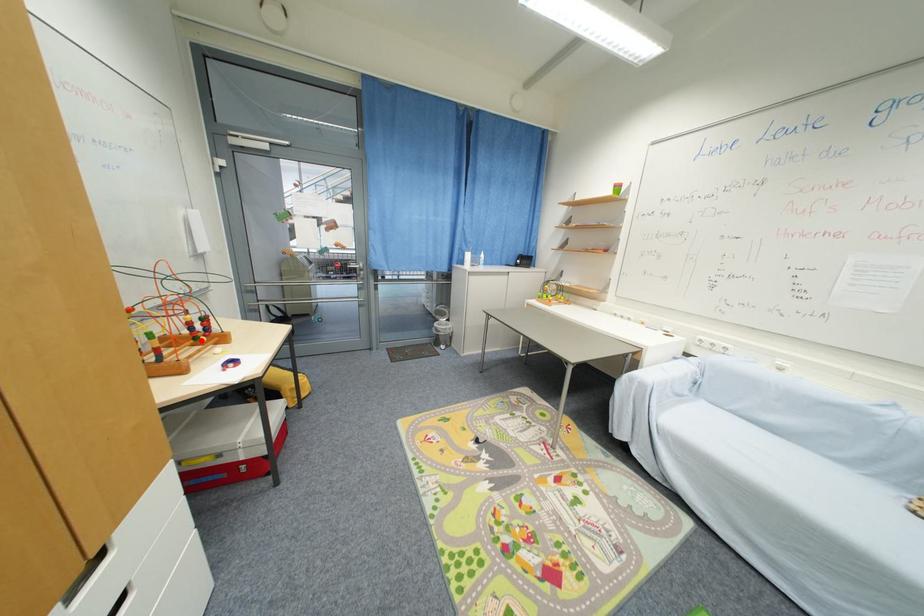
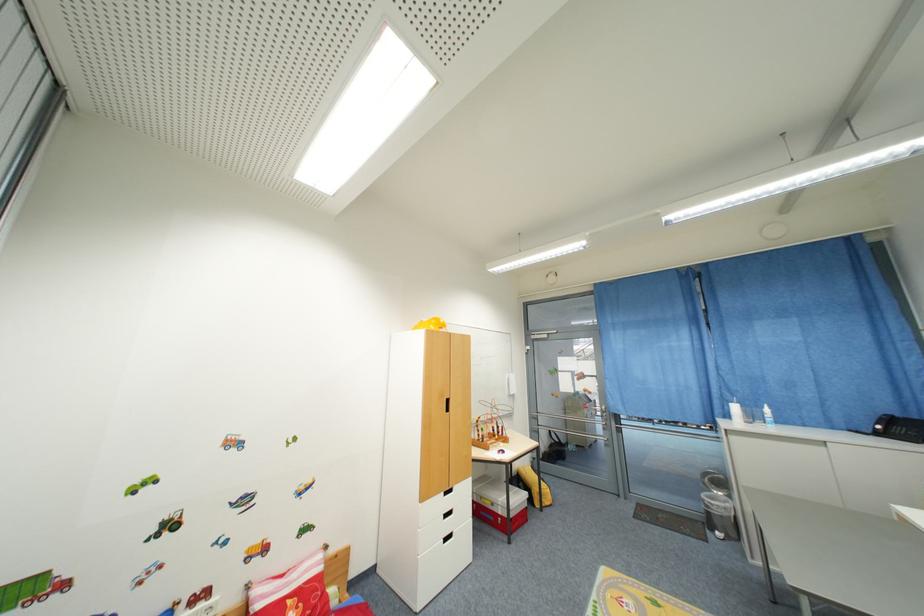
The point at the highlighted location is marked in the first image. Where is the corresponding point in the second image?

(500, 438)